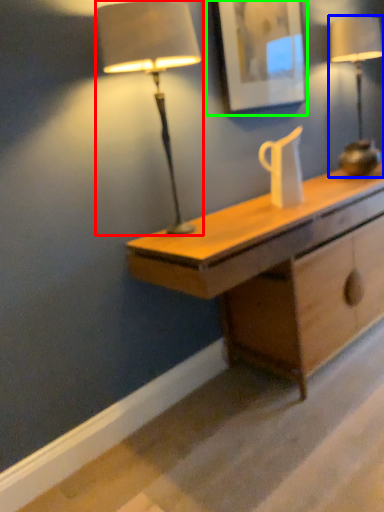
Question: Based on their relative distances, which object is nearer to lamp (highlighted by a red box)? Choose from lamp (highlighted by a blue box) and picture frame (highlighted by a green box).

Choices:
 (A) lamp
 (B) picture frame

Answer: (B)